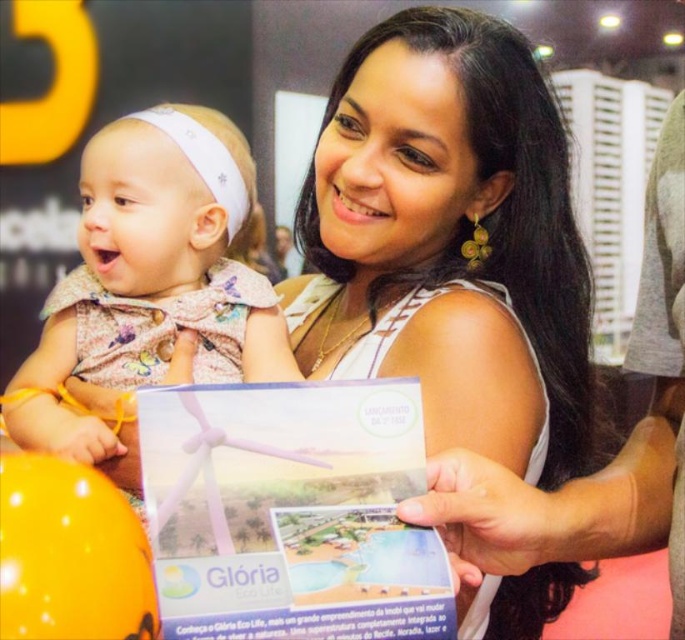
Is matte white brochure at center thinner than matte pink dress at center?

Indeed, matte white brochure at center has a lesser width compared to matte pink dress at center.

Based on the photo, does matte white brochure at center come behind matte pink dress at center?

No, it is in front of matte pink dress at center.

The image size is (685, 640). Identify the location of matte white brochure at center. (290, 513).

Who is positioned more to the right, matte white tank top at center or matte pink dress at center?

matte white tank top at center is more to the right.

Is matte white tank top at center in front of matte pink dress at center?

No.

You are a GUI agent. You are given a task and a screenshot of the screen. Output one action in this format:
    pyautogui.click(x=<x>, y=<y>)
    Task: Click on the matte white tank top at center
    The height and width of the screenshot is (640, 685).
    Given the screenshot: What is the action you would take?
    pyautogui.click(x=449, y=241)

At what (x,y) coordinates should I click in order to perform the action: click on matte white tank top at center. Please return your answer as a coordinate pair (x, y). Looking at the image, I should click on pos(449,241).

Is point (373, 264) closer to camera compared to point (251, 412)?

No, it is behind (251, 412).

Which is above, matte white tank top at center or matte white brochure at center?

matte white tank top at center

Which is in front, point (540, 275) or point (240, 394)?

Point (240, 394) is in front.

Locate an element on the screen. The width and height of the screenshot is (685, 640). matte white tank top at center is located at coordinates (449, 241).